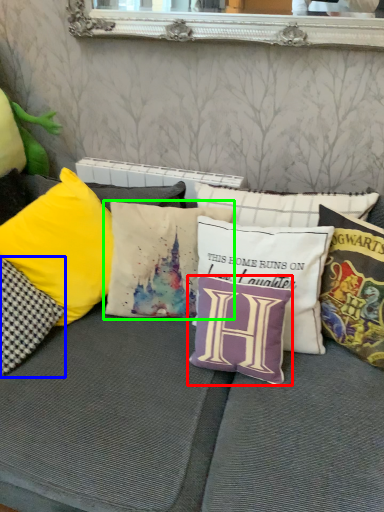
Question: Based on their relative distances, which object is farther from pillow (highlighted by a red box)? Choose from pillow (highlighted by a blue box) and pillow (highlighted by a green box).

Choices:
 (A) pillow
 (B) pillow

Answer: (A)